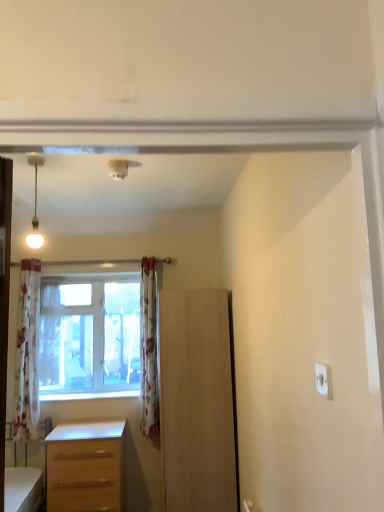
Question: Considering the relative sizes of white floral curtain at center, the second curtain from the right, and floral fabric curtain at center, positioned as the first curtain in right-to-left order, in the image provided, is white floral curtain at center, the second curtain from the right, taller than floral fabric curtain at center, positioned as the first curtain in right-to-left order,?

Choices:
 (A) no
 (B) yes

Answer: (A)

Question: Is floral fabric curtain at center, the third curtain in the left-to-right sequence, at the back of white floral curtain at center, the second curtain from the right?

Choices:
 (A) yes
 (B) no

Answer: (B)

Question: Does white floral curtain at center, which is the 2th curtain from left to right, have a greater width compared to floral fabric curtain at center, the third curtain in the left-to-right sequence?

Choices:
 (A) yes
 (B) no

Answer: (B)

Question: From the image's perspective, does white floral curtain at center, which is the 2th curtain from left to right, appear higher than floral fabric curtain at center, positioned as the first curtain in right-to-left order?

Choices:
 (A) yes
 (B) no

Answer: (A)

Question: Is white floral curtain at center, which is the 2th curtain from left to right, at the left side of floral fabric curtain at center, the third curtain in the left-to-right sequence?

Choices:
 (A) yes
 (B) no

Answer: (A)

Question: From a real-world perspective, is floral fabric curtain at left, the 1th curtain when ordered from left to right, positioned above or below matte white bulb at upper left?

Choices:
 (A) below
 (B) above

Answer: (A)

Question: Looking at their shapes, would you say floral fabric curtain at left, the 1th curtain when ordered from left to right, is wider or thinner than matte white bulb at upper left?

Choices:
 (A) thin
 (B) wide

Answer: (B)

Question: In terms of size, does floral fabric curtain at left, the 1th curtain when ordered from left to right, appear bigger or smaller than matte white bulb at upper left?

Choices:
 (A) big
 (B) small

Answer: (A)

Question: From the image's perspective, is floral fabric curtain at left, the 1th curtain when ordered from left to right, located above or below matte white bulb at upper left?

Choices:
 (A) below
 (B) above

Answer: (A)

Question: Is floral fabric curtain at left, positioned as the third curtain in right-to-left order, wider or thinner than floral fabric curtain at center, the third curtain in the left-to-right sequence?

Choices:
 (A) wide
 (B) thin

Answer: (A)

Question: Relative to floral fabric curtain at center, positioned as the first curtain in right-to-left order, is floral fabric curtain at left, positioned as the third curtain in right-to-left order, in front or behind?

Choices:
 (A) behind
 (B) front

Answer: (B)

Question: From the image's perspective, is floral fabric curtain at left, the 1th curtain when ordered from left to right, located above or below floral fabric curtain at center, positioned as the first curtain in right-to-left order?

Choices:
 (A) above
 (B) below

Answer: (A)

Question: In terms of height, does floral fabric curtain at left, the 1th curtain when ordered from left to right, look taller or shorter compared to floral fabric curtain at center, positioned as the first curtain in right-to-left order?

Choices:
 (A) tall
 (B) short

Answer: (B)

Question: Is matte white bulb at upper left to the left or to the right of white floral curtain at center, which is the 2th curtain from left to right, in the image?

Choices:
 (A) left
 (B) right

Answer: (B)

Question: Do you think matte white bulb at upper left is within white floral curtain at center, which is the 2th curtain from left to right, or outside of it?

Choices:
 (A) inside
 (B) outside

Answer: (B)